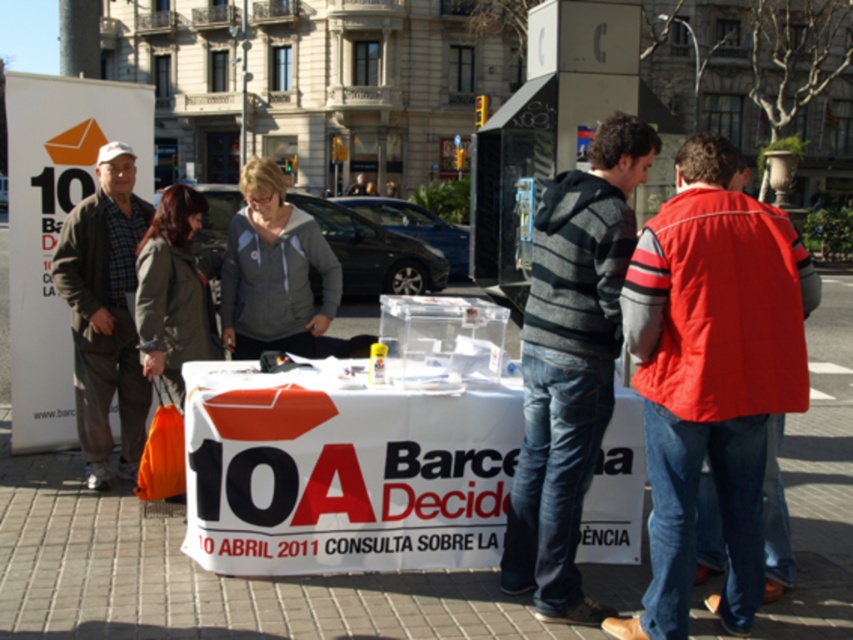
Question: Which object appears farthest from the camera in this image?

Choices:
 (A) plaid fabric shirt at left
 (B) striped hoodie at center

Answer: (A)

Question: Is red nylon jacket at center wider than gray fleece jacket at center?

Choices:
 (A) no
 (B) yes

Answer: (B)

Question: Which point is closer to the camera taking this photo?

Choices:
 (A) (79, 288)
 (B) (296, 324)
 (C) (210, 388)

Answer: (C)

Question: Does white paper table at center appear on the right side of plaid fabric shirt at left?

Choices:
 (A) yes
 (B) no

Answer: (A)

Question: Which object is positioned closest to the white paper table at center?

Choices:
 (A) striped hoodie at center
 (B) red nylon jacket at center
 (C) gray fleece jacket at center

Answer: (A)

Question: Is the position of plaid fabric shirt at left more distant than that of gray fleece jacket at center?

Choices:
 (A) no
 (B) yes

Answer: (B)